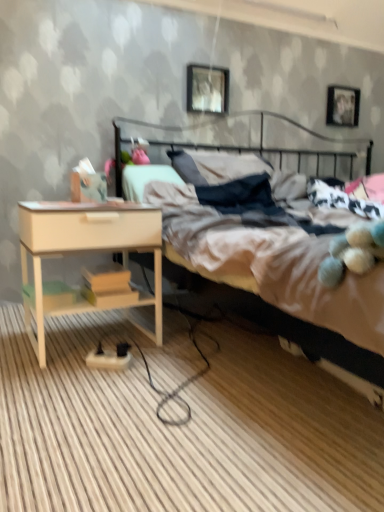
Question: From the image's perspective, is metallic black headboard at upper center under metallic silver picture frame at upper center, positioned as the second picture frame in right-to-left order?

Choices:
 (A) no
 (B) yes

Answer: (B)

Question: Does metallic black headboard at upper center have a greater width compared to metallic silver picture frame at upper center, acting as the 1th picture frame starting from the front?

Choices:
 (A) yes
 (B) no

Answer: (A)

Question: Is metallic black headboard at upper center smaller than metallic silver picture frame at upper center, positioned as the second picture frame in right-to-left order?

Choices:
 (A) no
 (B) yes

Answer: (A)

Question: Does metallic black headboard at upper center come in front of metallic silver picture frame at upper center, acting as the 1th picture frame starting from the front?

Choices:
 (A) yes
 (B) no

Answer: (A)

Question: Does metallic black headboard at upper center have a larger size compared to metallic silver picture frame at upper center, positioned as the second picture frame in right-to-left order?

Choices:
 (A) yes
 (B) no

Answer: (A)

Question: Does metallic black headboard at upper center appear on the left side of metallic silver picture frame at upper center, positioned as the 1th picture frame in left-to-right order?

Choices:
 (A) yes
 (B) no

Answer: (B)

Question: Does beige wood nightstand at lower left have a lesser height compared to metallic black headboard at upper center?

Choices:
 (A) yes
 (B) no

Answer: (B)

Question: Is beige wood nightstand at lower left further to camera compared to metallic black headboard at upper center?

Choices:
 (A) no
 (B) yes

Answer: (A)

Question: Is beige wood nightstand at lower left not close to metallic black headboard at upper center?

Choices:
 (A) yes
 (B) no

Answer: (B)

Question: Considering the relative sizes of beige wood nightstand at lower left and metallic black headboard at upper center in the image provided, is beige wood nightstand at lower left bigger than metallic black headboard at upper center?

Choices:
 (A) yes
 (B) no

Answer: (B)

Question: Can you confirm if beige wood nightstand at lower left is positioned to the right of metallic black headboard at upper center?

Choices:
 (A) yes
 (B) no

Answer: (B)

Question: Is beige wood nightstand at lower left aimed at metallic black headboard at upper center?

Choices:
 (A) yes
 (B) no

Answer: (B)

Question: From the image's perspective, does metallic silver picture frame at upper center, acting as the 1th picture frame starting from the front, appear higher than metallic silver picture frame at upper right, which is the 1th picture frame from right to left?

Choices:
 (A) yes
 (B) no

Answer: (B)